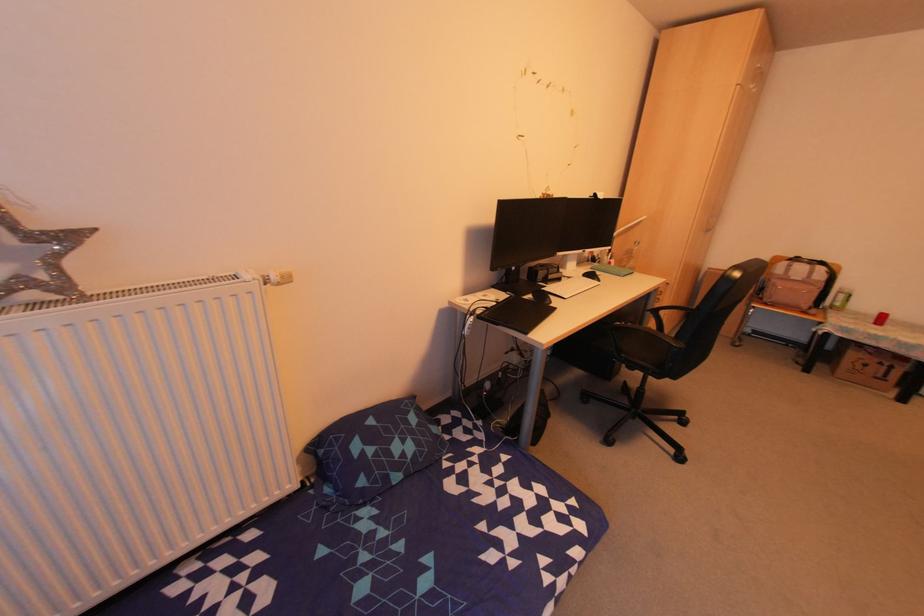
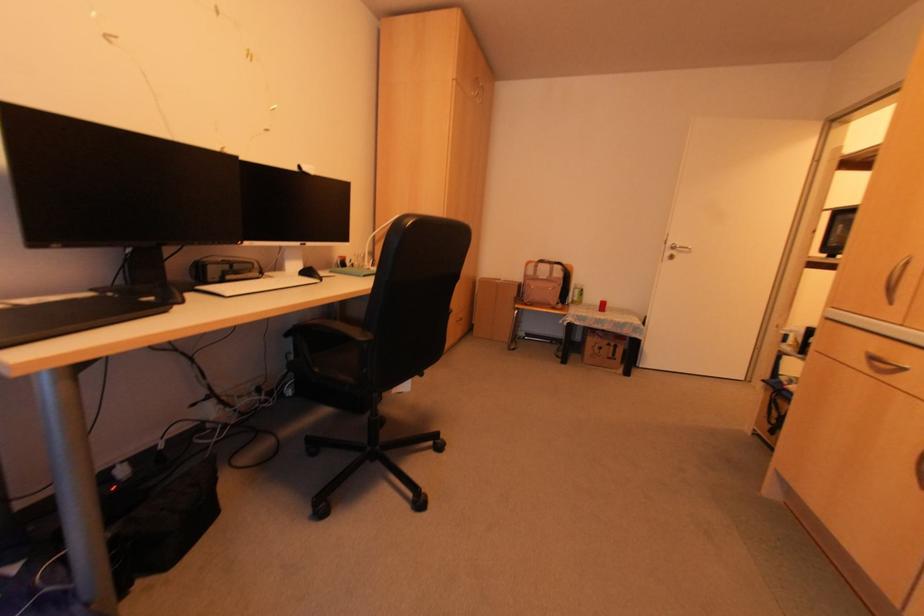
Find the pixel in the second image that matches pixel 877 362 in the first image.

(604, 342)